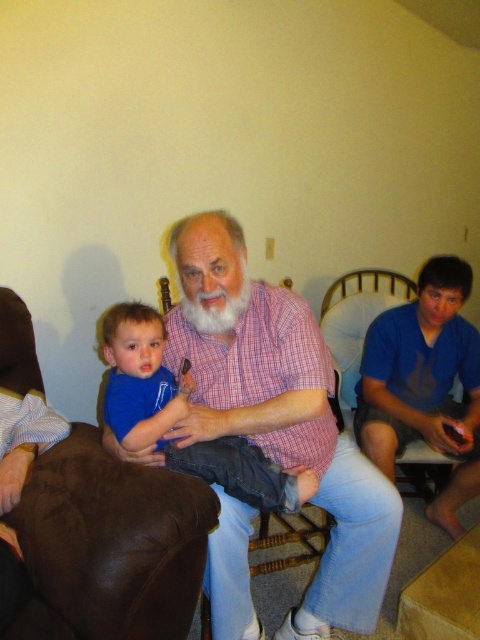
Question: Can you confirm if brown leather couch at lower left is positioned above blue denim jeans at center?

Choices:
 (A) yes
 (B) no

Answer: (B)

Question: Which point is farther to the camera?

Choices:
 (A) blue denim jeans at center
 (B) red plaid shirt at center

Answer: (B)

Question: Which point is closer to the camera?

Choices:
 (A) coord(244,269)
 (B) coord(189,608)
 (C) coord(133,332)
 (D) coord(336,433)

Answer: (B)

Question: Can you confirm if brown leather couch at lower left is positioned to the left of whitehairbeard at center?

Choices:
 (A) yes
 (B) no

Answer: (A)

Question: Does red plaid shirt at center have a greater width compared to blue denim jeans at center?

Choices:
 (A) no
 (B) yes

Answer: (B)

Question: Among these points, which one is nearest to the camera?

Choices:
 (A) (201, 296)
 (B) (116, 627)
 (C) (231, 433)

Answer: (B)